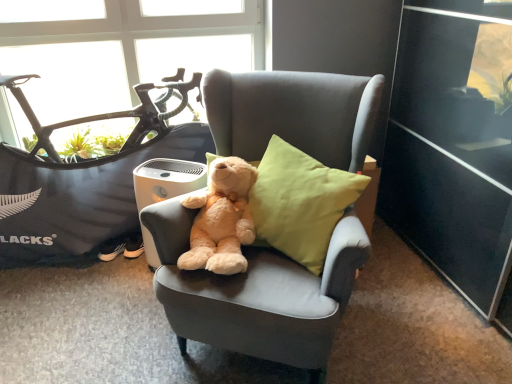
Image resolution: width=512 pixels, height=384 pixels. What are the coordinates of `vacant space situated on the left part of soft gray fabric chair at center` in the screenshot? It's located at (93, 321).